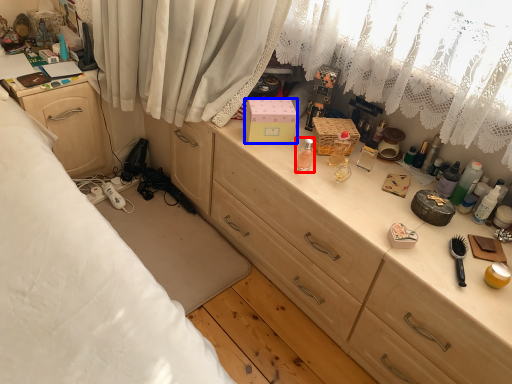
Question: Among these objects, which one is farthest to the camera, toiletry (highlighted by a red box) or box (highlighted by a blue box)?

Choices:
 (A) toiletry
 (B) box

Answer: (B)